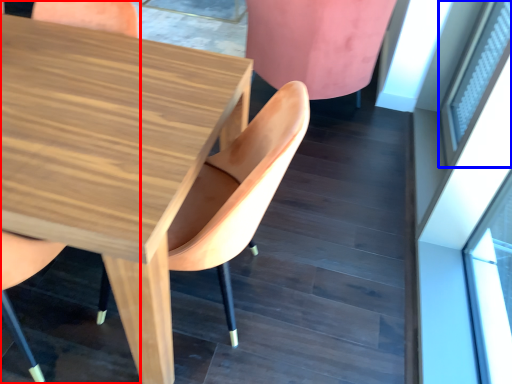
Question: Which object appears closest to the camera in this image, chair (highlighted by a red box) or window (highlighted by a blue box)?

Choices:
 (A) chair
 (B) window

Answer: (A)